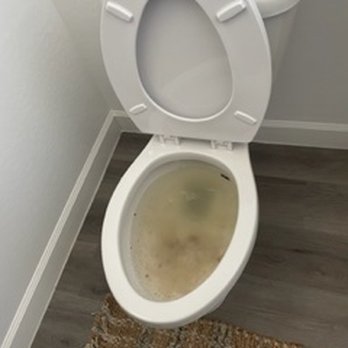
I want to click on underside of toilet lid, so click(x=183, y=38).